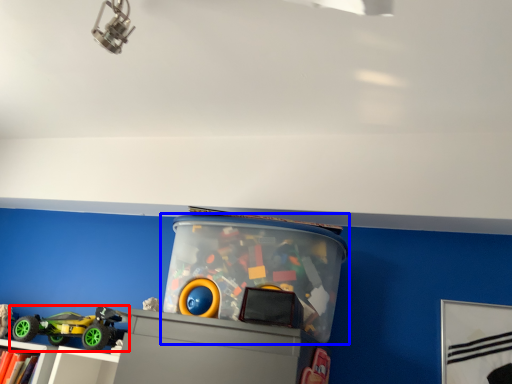
Question: Which of the following is the farthest to the observer, toy (highlighted by a red box) or toy (highlighted by a blue box)?

Choices:
 (A) toy
 (B) toy

Answer: (A)